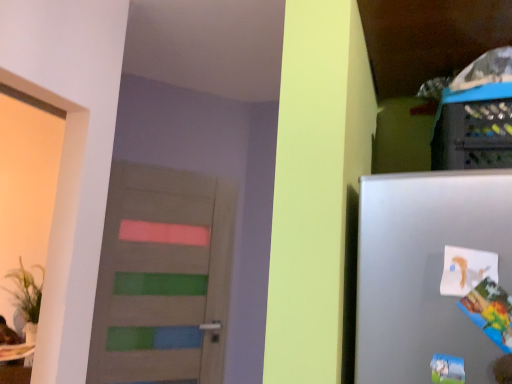
Identify the location of wooden door with painted stripes at center. Image resolution: width=512 pixels, height=384 pixels. (163, 277).

Describe the element at coordinates (163, 277) in the screenshot. I see `wooden door with painted stripes at center` at that location.

Image resolution: width=512 pixels, height=384 pixels. What do you see at coordinates (490, 312) in the screenshot?
I see `colorful paper comic book at right` at bounding box center [490, 312].

Locate an element on the screen. colorful paper comic book at right is located at coordinates (490, 312).

Where is `wooden door with painted stripes at center`? wooden door with painted stripes at center is located at coordinates (163, 277).

Is colorful paper comic book at right at the left side of wooden door with painted stripes at center?

No.

Is colorful paper comic book at right further to the viewer compared to wooden door with painted stripes at center?

No, it is in front of wooden door with painted stripes at center.

Considering the positions of point (477, 312) and point (213, 327), is point (477, 312) closer or farther from the camera than point (213, 327)?

Point (477, 312) is positioned closer to the camera compared to point (213, 327).

From the image's perspective, is colorful paper comic book at right located beneath wooden door with painted stripes at center?

No, from the image's perspective, colorful paper comic book at right is not below wooden door with painted stripes at center.

Consider the image. From a real-world perspective, which is physically above, colorful paper comic book at right or wooden door with painted stripes at center?

From a 3D spatial view, colorful paper comic book at right is above.

Can you confirm if colorful paper comic book at right is thinner than wooden door with painted stripes at center?

No.

Based on the photo, between colorful paper comic book at right and wooden door with painted stripes at center, which one has more height?

With more height is wooden door with painted stripes at center.

Considering the sizes of objects colorful paper comic book at right and wooden door with painted stripes at center in the image provided, who is smaller, colorful paper comic book at right or wooden door with painted stripes at center?

colorful paper comic book at right is smaller.

Which is correct: colorful paper comic book at right is inside wooden door with painted stripes at center, or outside of it?

colorful paper comic book at right cannot be found inside wooden door with painted stripes at center.

Does colorful paper comic book at right touch wooden door with painted stripes at center?

colorful paper comic book at right and wooden door with painted stripes at center are not in contact.

Is colorful paper comic book at right looking in the opposite direction of wooden door with painted stripes at center?

No, colorful paper comic book at right is not facing the opposite direction of wooden door with painted stripes at center.

How many degrees apart are the facing directions of colorful paper comic book at right and wooden door with painted stripes at center?

The angular difference between colorful paper comic book at right and wooden door with painted stripes at center is 38.2 degrees.

How far apart are colorful paper comic book at right and wooden door with painted stripes at center?

7.23 feet.

Image resolution: width=512 pixels, height=384 pixels. What are the coordinates of `comic book in front of the wooden door with painted stripes at center` in the screenshot? It's located at (490, 312).

In the image, is wooden door with painted stripes at center on the left side or the right side of colorful paper comic book at right?

Clearly, wooden door with painted stripes at center is on the left of colorful paper comic book at right in the image.

In the scene shown: Is wooden door with painted stripes at center closer to camera compared to colorful paper comic book at right?

No, wooden door with painted stripes at center is further to the viewer.

Considering the points (105, 324) and (507, 343), which point is behind, point (105, 324) or point (507, 343)?

The point (105, 324) is farther from the camera.

From the image's perspective, is wooden door with painted stripes at center under colorful paper comic book at right?

Yes, from the image's perspective, wooden door with painted stripes at center is beneath colorful paper comic book at right.

From a real-world perspective, is wooden door with painted stripes at center located beneath colorful paper comic book at right?

Yes, from a real-world perspective, wooden door with painted stripes at center is below colorful paper comic book at right.

Can you confirm if wooden door with painted stripes at center is wider than colorful paper comic book at right?

No.

Considering the sizes of objects wooden door with painted stripes at center and colorful paper comic book at right in the image provided, who is shorter, wooden door with painted stripes at center or colorful paper comic book at right?

Standing shorter between the two is colorful paper comic book at right.

Who is smaller, wooden door with painted stripes at center or colorful paper comic book at right?

With smaller size is colorful paper comic book at right.

From the picture: Is colorful paper comic book at right completely or partially inside wooden door with painted stripes at center?

No.

Is wooden door with painted stripes at center directly adjacent to colorful paper comic book at right?

No.

Is wooden door with painted stripes at center facing towards colorful paper comic book at right?

Yes, wooden door with painted stripes at center faces towards colorful paper comic book at right.

What's the angular difference between wooden door with painted stripes at center and colorful paper comic book at right's facing directions?

The angular difference between wooden door with painted stripes at center and colorful paper comic book at right is 38.2 degrees.

What are the coordinates of `door that is behind the colorful paper comic book at right` in the screenshot? It's located at (163, 277).

Where is `comic book above the wooden door with painted stripes at center (from a real-world perspective)`? The height and width of the screenshot is (384, 512). comic book above the wooden door with painted stripes at center (from a real-world perspective) is located at coordinates (490, 312).

Identify the location of comic book above the wooden door with painted stripes at center (from the image's perspective). (490, 312).